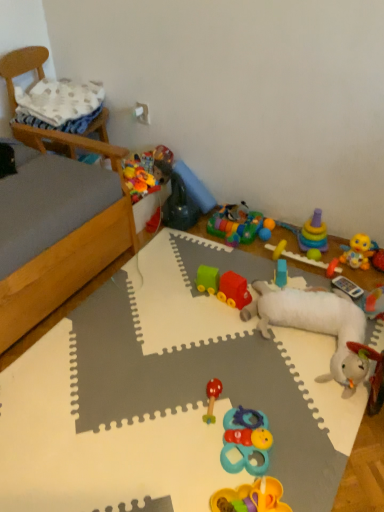
You are a GUI agent. You are given a task and a screenshot of the screen. Output one action in this format:
    pyautogui.click(x=<x>, y=<y>)
    Task: Click on the free region on the left part of rubberized plastic train at center, which is counted as the 4th toy, starting from the bottom
    
    Given the screenshot: What is the action you would take?
    pyautogui.click(x=181, y=297)